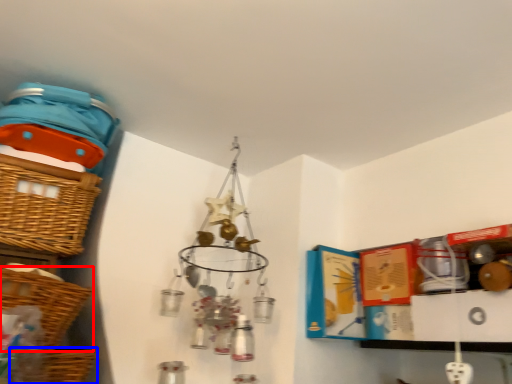
Question: Which of the following is the farthest to the observer, basket (highlighted by a red box) or basket (highlighted by a blue box)?

Choices:
 (A) basket
 (B) basket

Answer: (B)